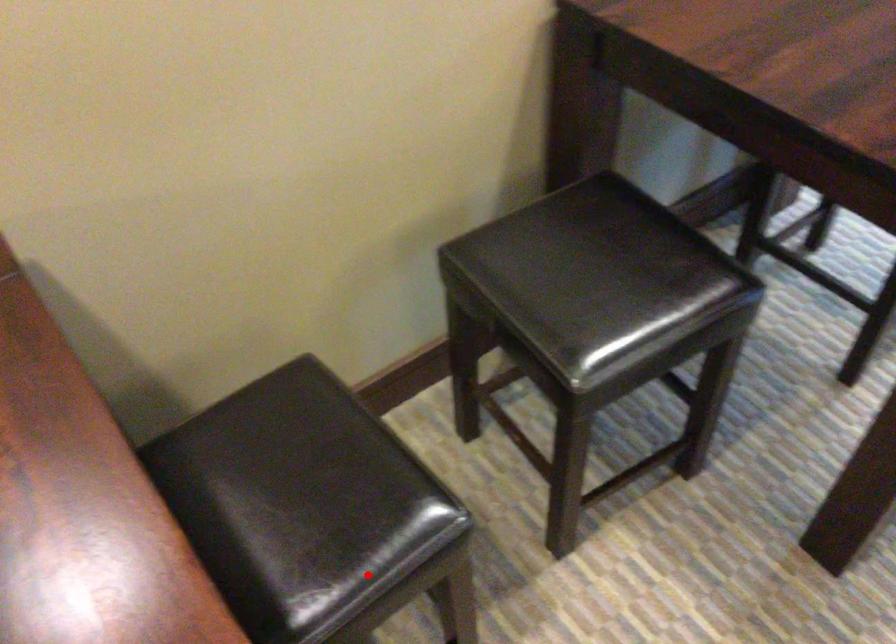
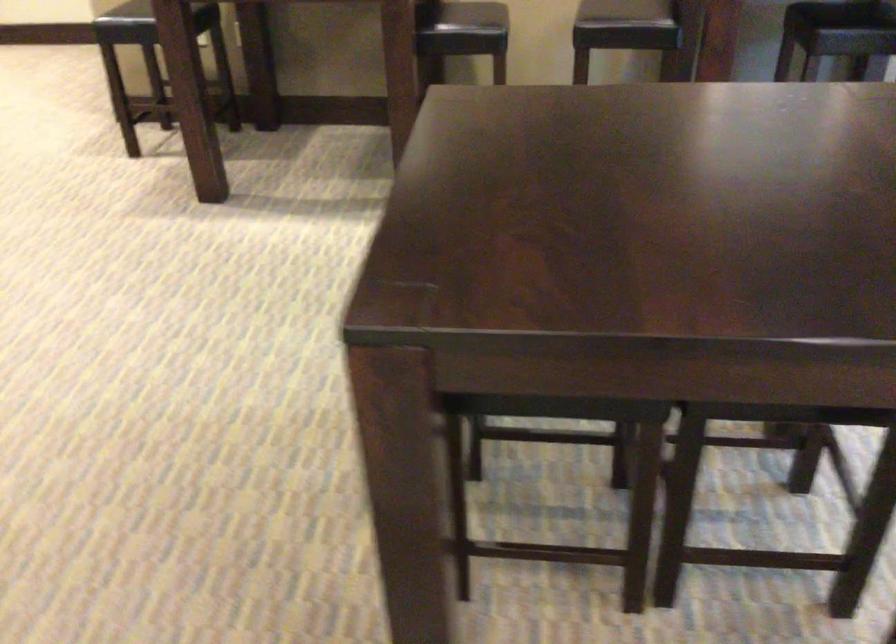
Where in the second image is the point corresponding to the highlighted location from the first image?

(464, 29)